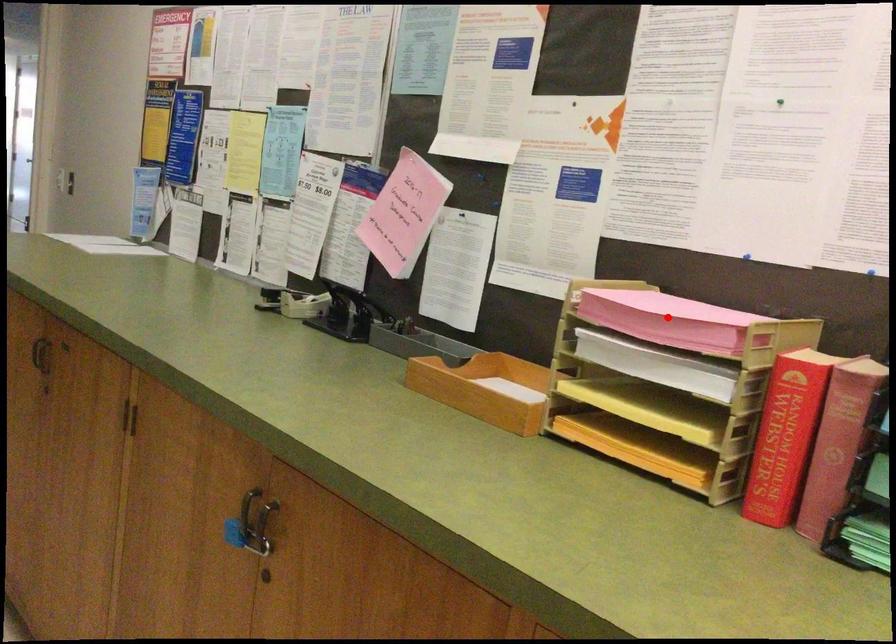
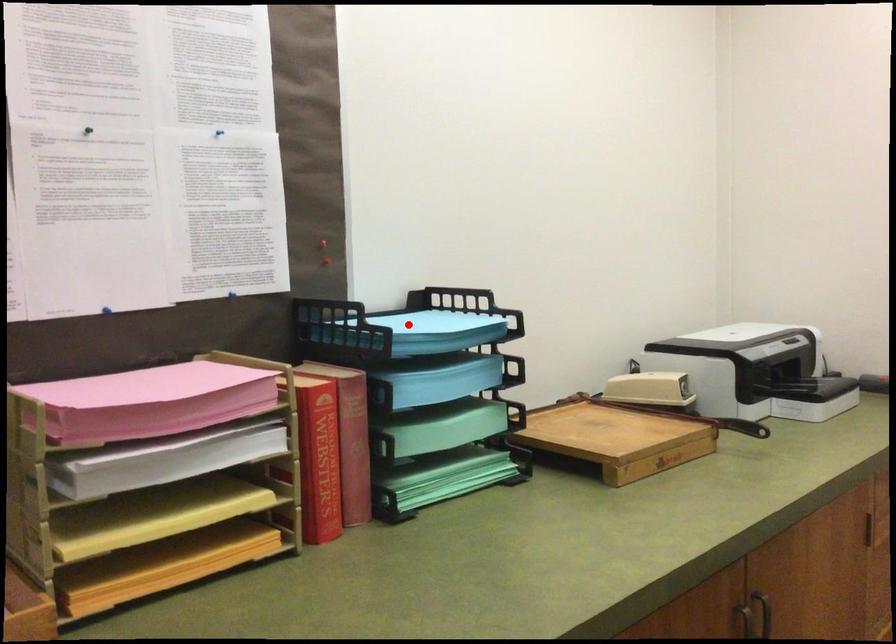
I am providing you with two images of the same scene from different viewpoints. A red point is marked on the first image and another point is marked on the second image. Do the highlighted points in image1 and image2 indicate the same real-world spot?

No